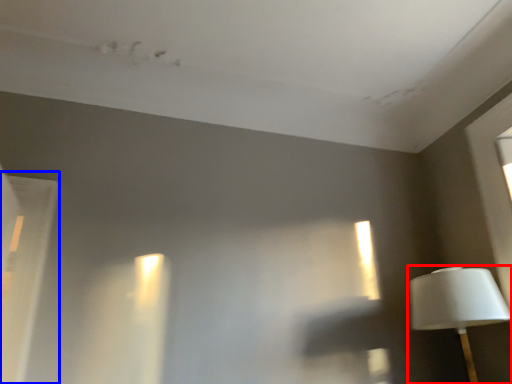
Question: Among these objects, which one is farthest to the camera, lamp (highlighted by a red box) or window (highlighted by a blue box)?

Choices:
 (A) lamp
 (B) window

Answer: (A)